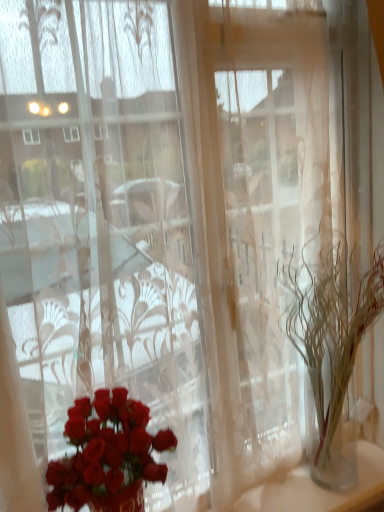
Question: Considering the relative positions of translucent glass vase at right and shiny red roses at lower left in the image provided, is translucent glass vase at right behind shiny red roses at lower left?

Choices:
 (A) yes
 (B) no

Answer: (A)

Question: Does translucent glass vase at right have a larger size compared to shiny red roses at lower left?

Choices:
 (A) no
 (B) yes

Answer: (B)

Question: Is translucent glass vase at right looking in the opposite direction of shiny red roses at lower left?

Choices:
 (A) no
 (B) yes

Answer: (A)

Question: Is translucent glass vase at right wider than shiny red roses at lower left?

Choices:
 (A) yes
 (B) no

Answer: (A)

Question: Is translucent glass vase at right surrounding shiny red roses at lower left?

Choices:
 (A) no
 (B) yes

Answer: (A)

Question: Is translucent glass vase at right outside shiny red roses at lower left?

Choices:
 (A) no
 (B) yes

Answer: (B)

Question: Is translucent glass vase at right completely or partially inside shiny red roses at lower left?

Choices:
 (A) no
 (B) yes

Answer: (A)

Question: Considering the relative sizes of shiny red roses at lower left and translucent glass vase at right in the image provided, is shiny red roses at lower left smaller than translucent glass vase at right?

Choices:
 (A) yes
 (B) no

Answer: (A)

Question: Is shiny red roses at lower left at the right side of translucent glass vase at right?

Choices:
 (A) yes
 (B) no

Answer: (B)

Question: Is shiny red roses at lower left directly adjacent to translucent glass vase at right?

Choices:
 (A) no
 (B) yes

Answer: (A)

Question: Can you confirm if shiny red roses at lower left is shorter than translucent glass vase at right?

Choices:
 (A) yes
 (B) no

Answer: (A)

Question: Does shiny red roses at lower left appear on the left side of translucent glass vase at right?

Choices:
 (A) no
 (B) yes

Answer: (B)

Question: From a real-world perspective, is shiny red roses at lower left positioned above or below translucent glass vase at right?

Choices:
 (A) above
 (B) below

Answer: (B)